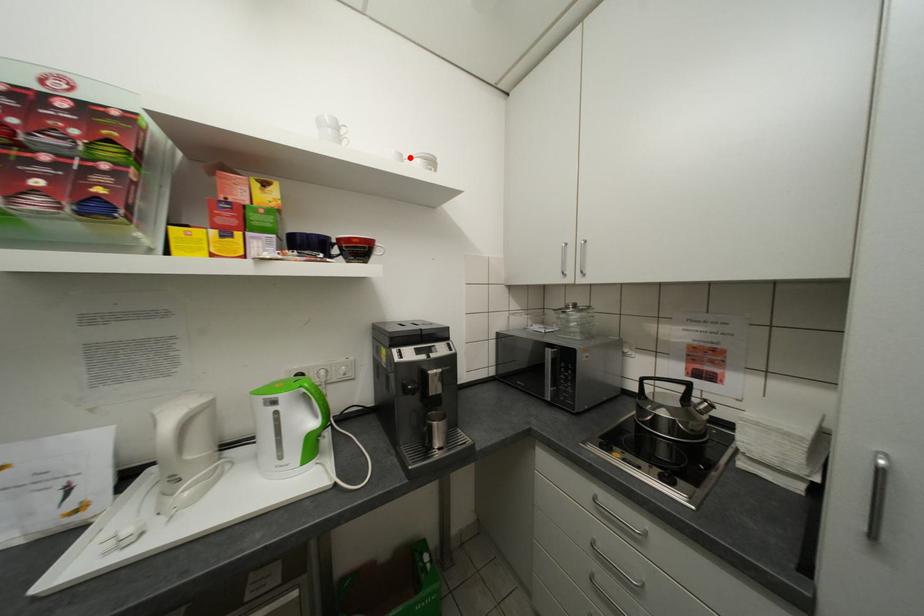
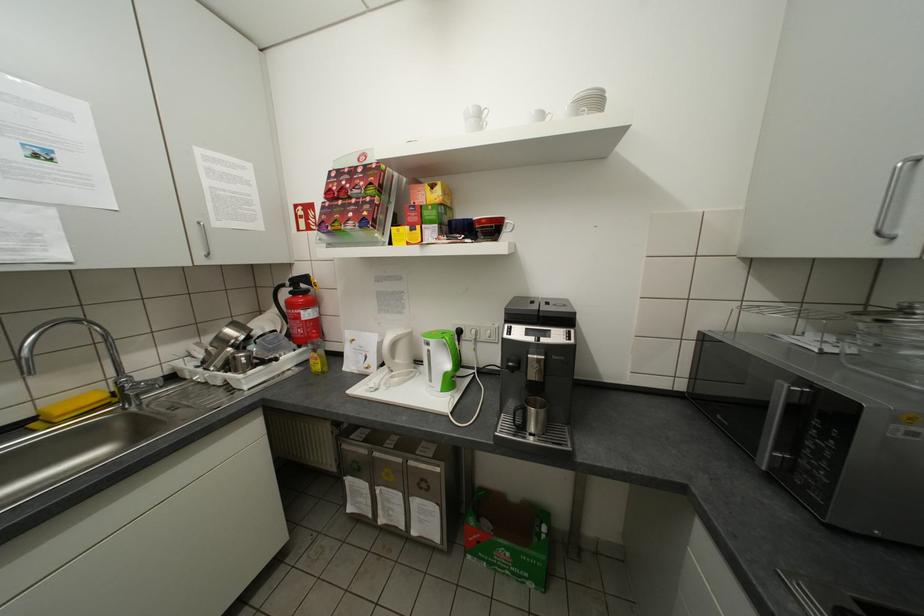
The point at the highlighted location is marked in the first image. Where is the corresponding point in the second image?

(551, 116)